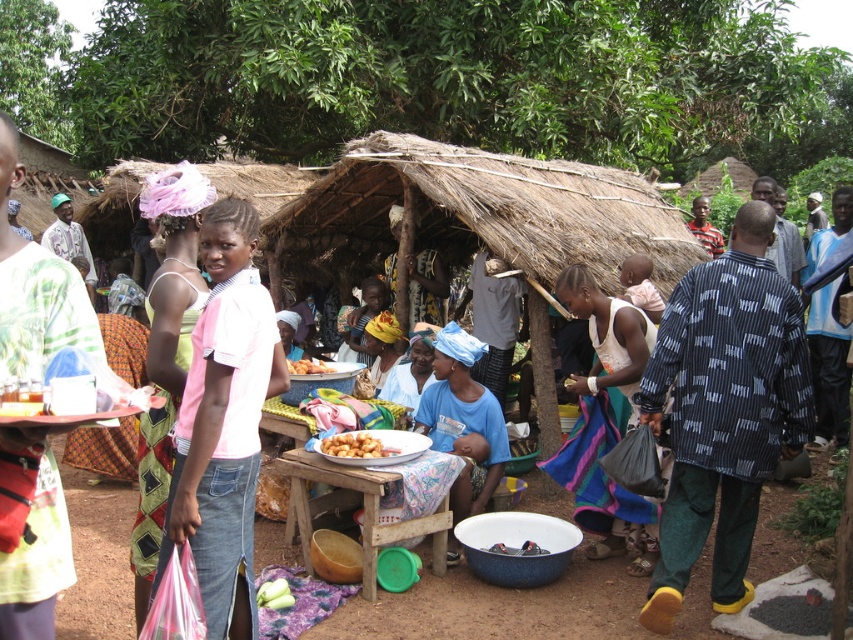
Question: Which of the following is the farthest from the observer?

Choices:
 (A) pink cotton shirt at center
 (B) golden brown fried balls at center
 (C) smooth plastic bowl at center

Answer: (B)

Question: Does smooth plastic bowl at center appear under golden brown fried balls at center?

Choices:
 (A) no
 (B) yes

Answer: (B)

Question: Which object is positioned closest to the pink cotton shirt at center?

Choices:
 (A) golden brown fried balls at center
 (B) white cotton dress at center

Answer: (A)

Question: From the image, what is the correct spatial relationship of pink fabric headscarf at upper left in relation to golden brown fried balls at center?

Choices:
 (A) below
 (B) above

Answer: (A)

Question: Which of these objects is positioned farthest from the golden crispy fried balls at center?

Choices:
 (A) smooth plastic bowl at center
 (B) white cotton dress at center
 (C) pink fabric headscarf at upper left

Answer: (B)

Question: Can you confirm if pink cotton shirt at center is positioned below golden crispy fried balls at center?

Choices:
 (A) yes
 (B) no

Answer: (B)